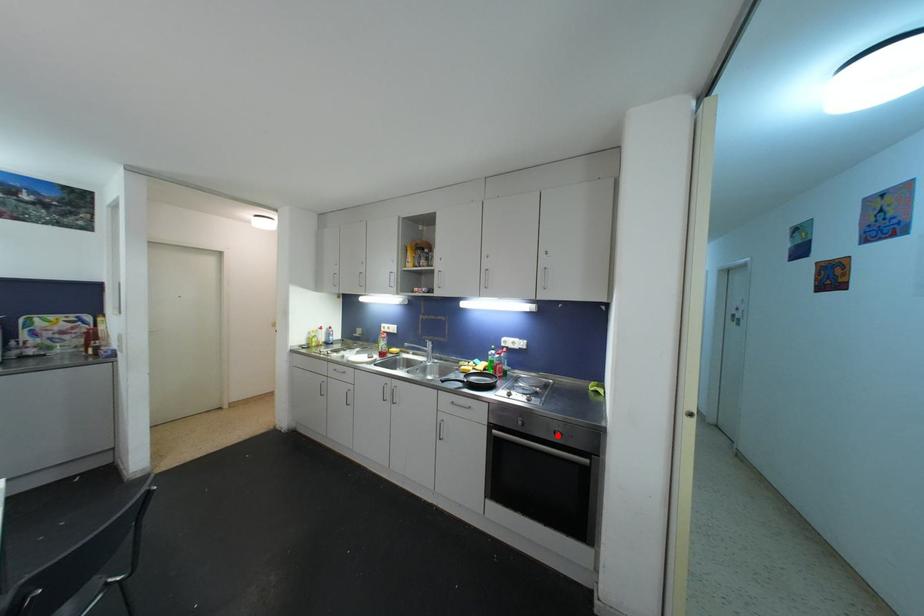
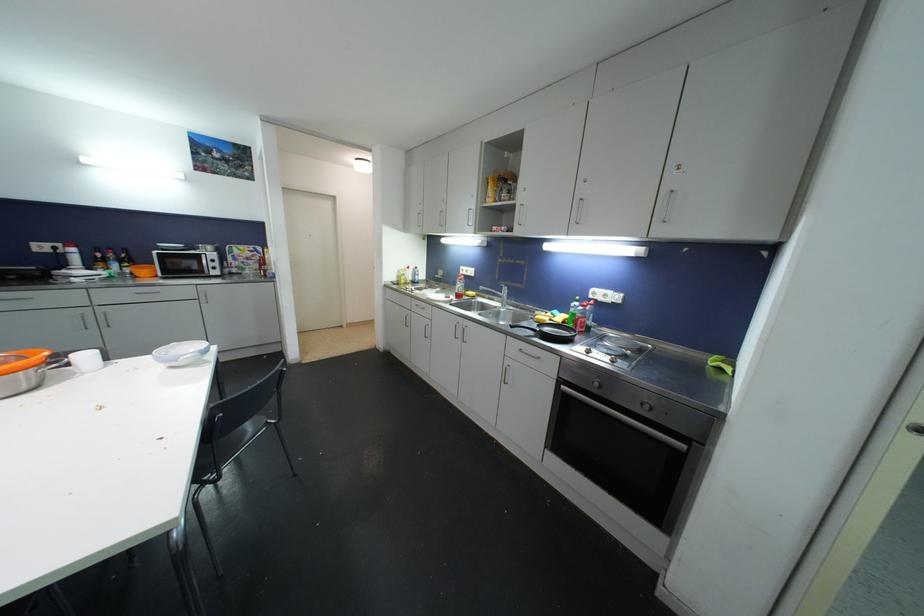
Where in the second image is the point corresponding to the highlighted location from the first image?

(646, 407)